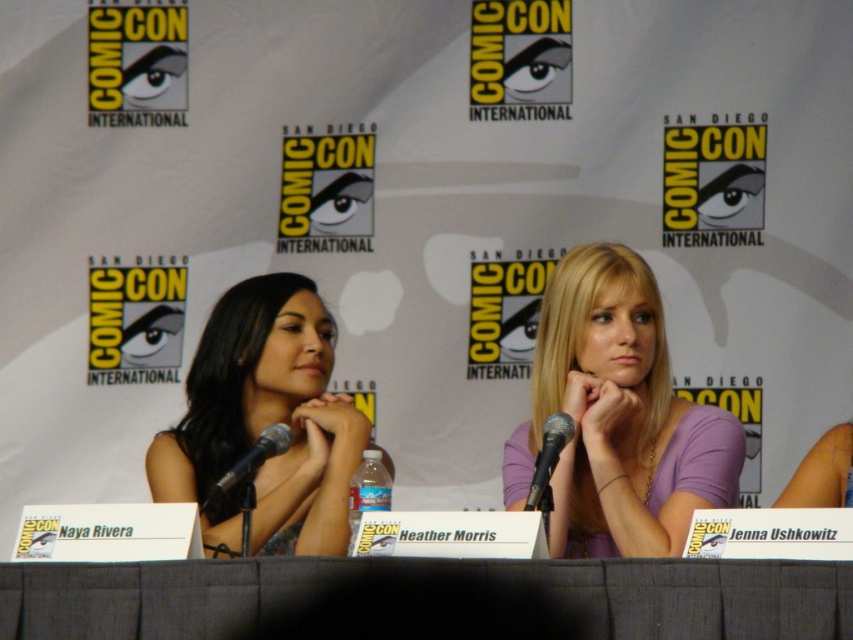
Is point (640, 292) positioned after point (194, 477)?

No.

Is point (579, 365) behind point (196, 356)?

No.

In order to click on purple matte shirt at center in this screenshot , I will do `click(618, 417)`.

Can you confirm if gray fabric table at center is smaller than purple matte shirt at center?

Indeed, gray fabric table at center has a smaller size compared to purple matte shirt at center.

Image resolution: width=853 pixels, height=640 pixels. Describe the element at coordinates (432, 596) in the screenshot. I see `gray fabric table at center` at that location.

I want to click on gray fabric table at center, so click(x=432, y=596).

Describe the element at coordinates (432, 596) in the screenshot. This screenshot has width=853, height=640. I see `gray fabric table at center` at that location.

Does gray fabric table at center come in front of matte black dress at center?

Yes, gray fabric table at center is in front of matte black dress at center.

Looking at this image, measure the distance between gray fabric table at center and camera.

gray fabric table at center and camera are 7.98 feet apart.

Where is `gray fabric table at center`? This screenshot has width=853, height=640. gray fabric table at center is located at coordinates 432,596.